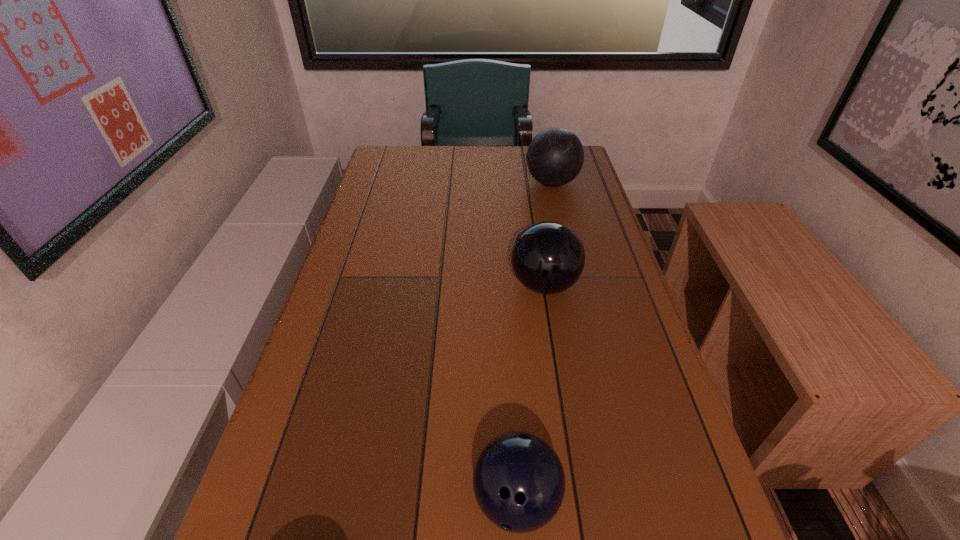
Find the location of `free region at the far edge of the desktop`. free region at the far edge of the desktop is located at coordinates (464, 162).

Where is `vacant space at the left edge`? This screenshot has width=960, height=540. vacant space at the left edge is located at coordinates (290, 440).

Locate an element on the screen. This screenshot has height=540, width=960. free location at the right edge of the desktop is located at coordinates (646, 508).

The width and height of the screenshot is (960, 540). Find the location of `vacant region at the far left corner`. vacant region at the far left corner is located at coordinates (403, 163).

Locate which object is the second closest to the nearest object. Please provide its 2D coordinates. Your answer should be formatted as a tuple, i.e. [(x, y)], where the tuple contains the x and y coordinates of a point satisfying the conditions above.

[(555, 156)]

I want to click on the closest object to the farthest bowling ball, so click(548, 257).

Select which bowling ball appears as the second closest to the farthest object. Please provide its 2D coordinates. Your answer should be formatted as a tuple, i.e. [(x, y)], where the tuple contains the x and y coordinates of a point satisfying the conditions above.

[(518, 479)]

The width and height of the screenshot is (960, 540). Identify the location of bowling ball that is the nearest to the second farthest object. (555, 156).